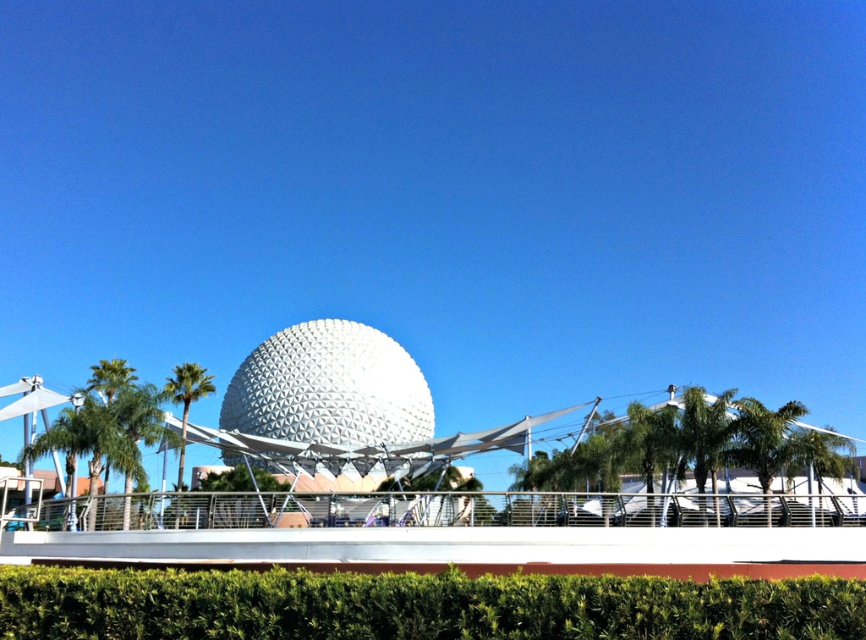
You are a landscape architect designing a pathway between the green leafy hedge at lower center and the green leafy palm tree at left. Which object is wider to ensure proper spacing?

The green leafy hedge at lower center is wider than the green leafy palm tree at left, so you should design the pathway to accommodate the wider hedge.

Looking at this image, you are a visitor standing at the entrance of Epcot and see the green leafy hedge at lower center and the green leafy palm tree at left. Which one is more to the left?

The green leafy palm tree at left is more to the left.